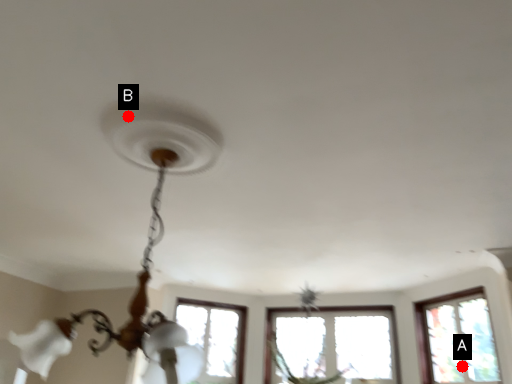
Question: Two points are circled on the image, labeled by A and B beside each circle. Which point appears farthest from the camera in this image?

Choices:
 (A) A is further
 (B) B is further

Answer: (A)